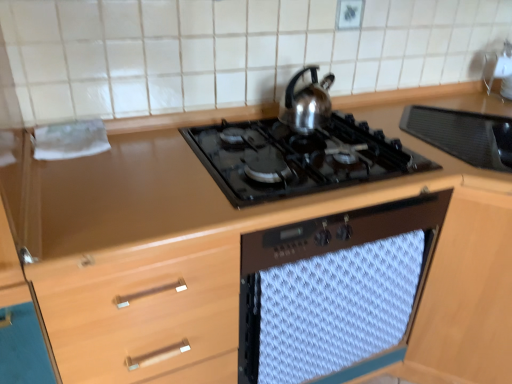
Question: Is white textured towel at center looking in the opposite direction of satin silver kettle at upper center?

Choices:
 (A) no
 (B) yes

Answer: (A)

Question: Can you confirm if white textured towel at center is wider than satin silver kettle at upper center?

Choices:
 (A) no
 (B) yes

Answer: (A)

Question: From the image's perspective, is white textured towel at center under satin silver kettle at upper center?

Choices:
 (A) no
 (B) yes

Answer: (B)

Question: Does white textured towel at center lie in front of satin silver kettle at upper center?

Choices:
 (A) yes
 (B) no

Answer: (A)

Question: Is white textured towel at center beside satin silver kettle at upper center?

Choices:
 (A) yes
 (B) no

Answer: (B)

Question: Considering the relative positions of white textured towel at center and satin silver kettle at upper center in the image provided, is white textured towel at center to the right of satin silver kettle at upper center from the viewer's perspective?

Choices:
 (A) no
 (B) yes

Answer: (B)

Question: Is black glass gas stove at center in contact with white textured towel at center?

Choices:
 (A) yes
 (B) no

Answer: (B)

Question: From a real-world perspective, is black glass gas stove at center below white textured towel at center?

Choices:
 (A) yes
 (B) no

Answer: (B)

Question: From a real-world perspective, is black glass gas stove at center located higher than white textured towel at center?

Choices:
 (A) yes
 (B) no

Answer: (A)

Question: Is black glass gas stove at center to the left of white textured towel at center from the viewer's perspective?

Choices:
 (A) no
 (B) yes

Answer: (B)

Question: Is black glass gas stove at center shorter than white textured towel at center?

Choices:
 (A) yes
 (B) no

Answer: (A)

Question: Can you confirm if black glass gas stove at center is taller than white textured towel at center?

Choices:
 (A) yes
 (B) no

Answer: (B)

Question: Can you confirm if satin silver kettle at upper center is positioned to the left of black glass gas stove at center?

Choices:
 (A) no
 (B) yes

Answer: (A)